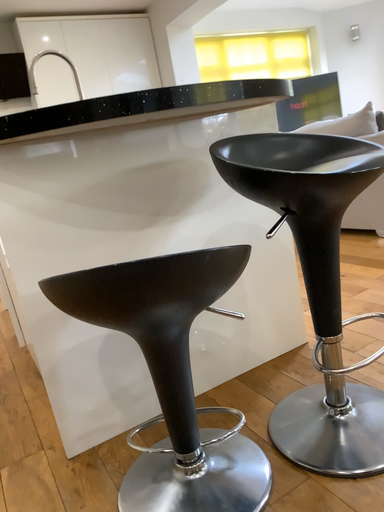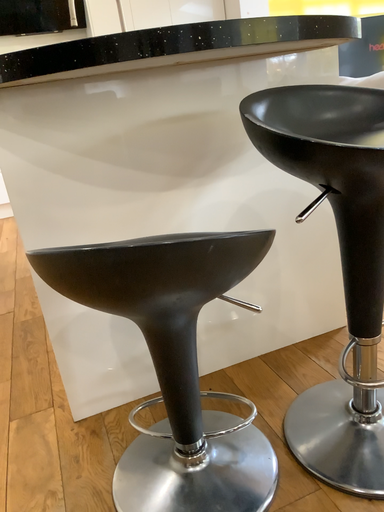
Question: How did the camera likely rotate when shooting the video?

Choices:
 (A) rotated right
 (B) rotated left

Answer: (B)